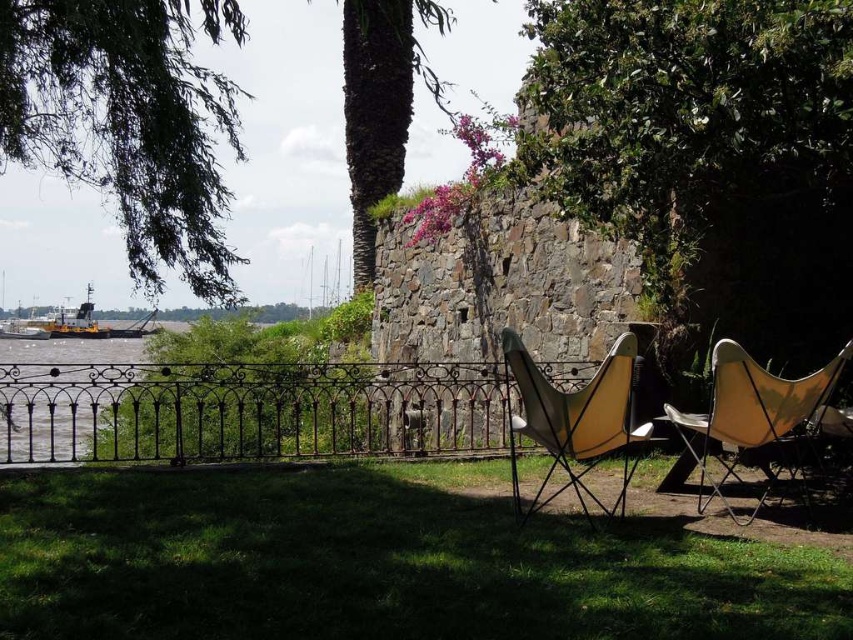
You are planning to place a new small garden statue that is 1 meter wide in the scene. Given the green grass at lower center and the yellow matte boat at lower left, which area would be more suitable for placing the statue without overcrowding the space?

The green grass at lower center has a larger size compared to the yellow matte boat at lower left, so placing the 1 meter wide garden statue on the green grass at lower center would be more suitable as it provides enough space without overcrowding.

You are standing at the edge of the water and want to reach the matte yellow chair at center without stepping on the yellow matte boat at lower left. Which direction should you move towards?

The matte yellow chair at center is in front of the yellow matte boat at lower left, so you should move forward towards the matte yellow chair at center to avoid stepping on the boat.